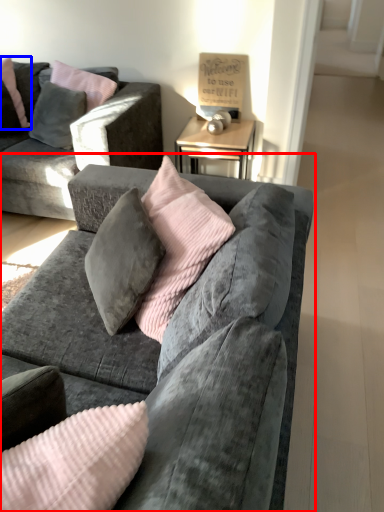
Question: Which point is closer to the camera, studio couch (highlighted by a red box) or pillow (highlighted by a blue box)?

Choices:
 (A) studio couch
 (B) pillow

Answer: (A)